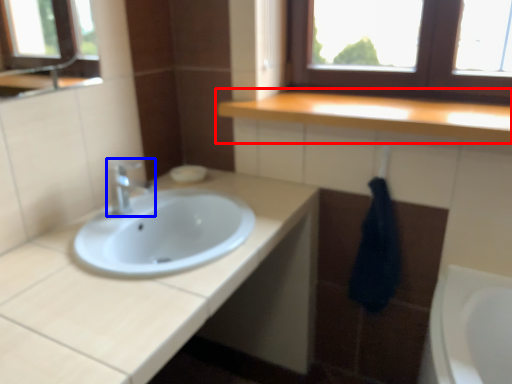
Question: Which object appears closest to the camera in this image, countertop (highlighted by a red box) or tap (highlighted by a blue box)?

Choices:
 (A) countertop
 (B) tap

Answer: (A)